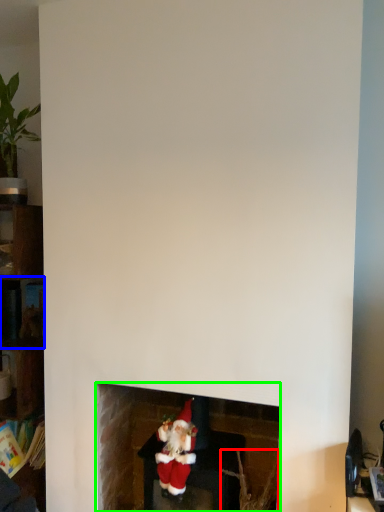
Question: Considering the real-world distances, which object is farthest from plant (highlighted by a red box)? shelf (highlighted by a blue box) or fireplace (highlighted by a green box)?

Choices:
 (A) shelf
 (B) fireplace

Answer: (A)